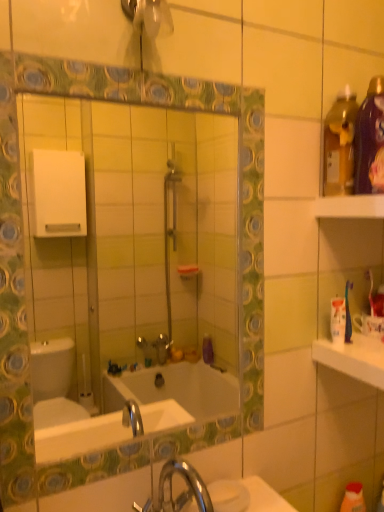
Question: Is white glossy countertop at right thinner than white plastic shelf at upper right?

Choices:
 (A) yes
 (B) no

Answer: (B)

Question: Can you confirm if white glossy countertop at right is taller than white plastic shelf at upper right?

Choices:
 (A) no
 (B) yes

Answer: (B)

Question: Is white glossy countertop at right positioned far away from white plastic shelf at upper right?

Choices:
 (A) no
 (B) yes

Answer: (A)

Question: From a real-world perspective, is white glossy countertop at right positioned under white plastic shelf at upper right based on gravity?

Choices:
 (A) yes
 (B) no

Answer: (A)

Question: Is white glossy countertop at right wider than white plastic shelf at upper right?

Choices:
 (A) no
 (B) yes

Answer: (B)

Question: From the image's perspective, is white glossy countertop at right positioned above or below white plastic shelf at upper right?

Choices:
 (A) above
 (B) below

Answer: (B)

Question: Looking at their shapes, would you say white glossy countertop at right is wider or thinner than white plastic shelf at upper right?

Choices:
 (A) thin
 (B) wide

Answer: (B)

Question: From a real-world perspective, is white glossy countertop at right above or below white plastic shelf at upper right?

Choices:
 (A) below
 (B) above

Answer: (A)

Question: Visually, is white glossy countertop at right positioned to the left or to the right of white plastic shelf at upper right?

Choices:
 (A) right
 (B) left

Answer: (A)

Question: From the image's perspective, relative to green glossy mirror at center, is white glossy countertop at right above or below?

Choices:
 (A) below
 (B) above

Answer: (A)

Question: Based on their positions, is white glossy countertop at right located to the left or right of green glossy mirror at center?

Choices:
 (A) left
 (B) right

Answer: (B)

Question: Is white glossy countertop at right inside the boundaries of green glossy mirror at center, or outside?

Choices:
 (A) inside
 (B) outside

Answer: (B)

Question: Looking at the image, does white glossy countertop at right seem bigger or smaller compared to green glossy mirror at center?

Choices:
 (A) small
 (B) big

Answer: (A)

Question: Looking at their shapes, would you say green glossy mirror at center is wider or thinner than white plastic shelf at upper right?

Choices:
 (A) wide
 (B) thin

Answer: (B)

Question: From a real-world perspective, is green glossy mirror at center physically located above or below white plastic shelf at upper right?

Choices:
 (A) below
 (B) above

Answer: (A)